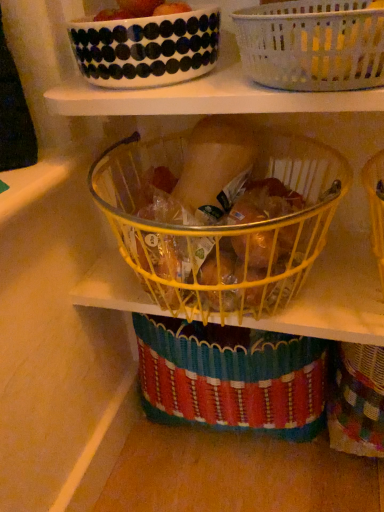
Locate an element on the screen. Image resolution: width=384 pixels, height=512 pixels. white woven basket at upper center, which is the 2th basket in bottom-to-top order is located at coordinates (312, 45).

Find the location of a particular element. The height and width of the screenshot is (512, 384). yellow wire basket at center, which ranks as the second basket in top-to-bottom order is located at coordinates (221, 221).

Locate an element on the screen. white glossy bowl at upper center is located at coordinates pos(147,48).

This screenshot has height=512, width=384. What are the coordinates of `white woven basket at upper center, which is the 2th basket in bottom-to-top order` in the screenshot? It's located at (312, 45).

Based on the photo, what's the angular difference between smooth red tomato at upper center and yellow wire basket at center, the first basket positioned from the bottom,'s facing directions?

They differ by 0.00177 degrees in their facing directions.

Is smooth red tomato at upper center facing towards yellow wire basket at center, the first basket positioned from the bottom?

No, smooth red tomato at upper center is not aimed at yellow wire basket at center, the first basket positioned from the bottom.

Who is bigger, smooth red tomato at upper center or yellow wire basket at center, the first basket positioned from the bottom?

yellow wire basket at center, the first basket positioned from the bottom.

Measure the distance between smooth red tomato at upper center and yellow wire basket at center, which ranks as the second basket in top-to-bottom order.

smooth red tomato at upper center and yellow wire basket at center, which ranks as the second basket in top-to-bottom order, are 11.95 inches apart from each other.

Does yellow wire basket at center, which ranks as the second basket in top-to-bottom order, turn towards white woven basket at upper center, which appears as the 1th basket when viewed from the top?

No.

In the image, is yellow wire basket at center, which ranks as the second basket in top-to-bottom order, on the left side or the right side of white woven basket at upper center, which appears as the 1th basket when viewed from the top?

From the image, it's evident that yellow wire basket at center, which ranks as the second basket in top-to-bottom order, is to the left of white woven basket at upper center, which appears as the 1th basket when viewed from the top.

Does yellow wire basket at center, which ranks as the second basket in top-to-bottom order, have a greater width compared to white woven basket at upper center, which appears as the 1th basket when viewed from the top?

Yes.

Is yellow wire basket at center, the first basket positioned from the bottom, far from white woven basket at upper center, which is the 2th basket in bottom-to-top order?

No, yellow wire basket at center, the first basket positioned from the bottom, is in close proximity to white woven basket at upper center, which is the 2th basket in bottom-to-top order.

Is point (331, 46) less distant than point (78, 21)?

Yes, point (331, 46) is closer to viewer.

Would you consider white woven basket at upper center, which is the 2th basket in bottom-to-top order, to be distant from white glossy bowl at upper center?

Actually, white woven basket at upper center, which is the 2th basket in bottom-to-top order, and white glossy bowl at upper center are a little close together.

Looking at this image, between white woven basket at upper center, which is the 2th basket in bottom-to-top order, and white glossy bowl at upper center, which one is positioned behind?

white glossy bowl at upper center is more distant.

Consider the image. From the image's perspective, which is above, white glossy bowl at upper center or white woven basket at upper center, which appears as the 1th basket when viewed from the top?

white glossy bowl at upper center is shown above in the image.

Does white glossy bowl at upper center have a lesser height compared to white woven basket at upper center, which is the 2th basket in bottom-to-top order?

Yes.

Which is in front, point (174, 76) or point (364, 26)?

The point (364, 26) is closer.

From a real-world perspective, between white glossy bowl at upper center and white woven basket at upper center, which is the 2th basket in bottom-to-top order, who is vertically higher?

From a 3D spatial view, white glossy bowl at upper center is above.

Is white glossy bowl at upper center inside yellow wire basket at center, the first basket positioned from the bottom?

No, white glossy bowl at upper center is not inside yellow wire basket at center, the first basket positioned from the bottom.

Based on their sizes in the image, would you say yellow wire basket at center, the first basket positioned from the bottom, is bigger or smaller than white glossy bowl at upper center?

Considering their sizes, yellow wire basket at center, the first basket positioned from the bottom, takes up more space than white glossy bowl at upper center.

Is yellow wire basket at center, which ranks as the second basket in top-to-bottom order, placed right next to white glossy bowl at upper center?

yellow wire basket at center, which ranks as the second basket in top-to-bottom order, and white glossy bowl at upper center are not in contact.

Does yellow wire basket at center, which ranks as the second basket in top-to-bottom order, have a lesser height compared to white glossy bowl at upper center?

No, yellow wire basket at center, which ranks as the second basket in top-to-bottom order, is not shorter than white glossy bowl at upper center.

You are a GUI agent. You are given a task and a screenshot of the screen. Output one action in this format:
    pyautogui.click(x=<x>, y=<y>)
    Task: Click on the fruit behind the yellow wire basket at center, which ranks as the second basket in top-to-bottom order
    
    Given the screenshot: What is the action you would take?
    pyautogui.click(x=138, y=7)

Is yellow wire basket at center, the first basket positioned from the bottom, looking in the opposite direction of smooth red tomato at upper center?

No, yellow wire basket at center, the first basket positioned from the bottom, is not facing away from smooth red tomato at upper center.

Consider the image. From a real-world perspective, which is physically below, yellow wire basket at center, which ranks as the second basket in top-to-bottom order, or smooth red tomato at upper center?

yellow wire basket at center, which ranks as the second basket in top-to-bottom order.

Can you confirm if yellow wire basket at center, the first basket positioned from the bottom, is thinner than smooth red tomato at upper center?

Incorrect, the width of yellow wire basket at center, the first basket positioned from the bottom, is not less than that of smooth red tomato at upper center.

Do you think smooth red tomato at upper center is within white woven basket at upper center, which appears as the 1th basket when viewed from the top, or outside of it?

smooth red tomato at upper center is outside white woven basket at upper center, which appears as the 1th basket when viewed from the top.

Is smooth red tomato at upper center looking in the opposite direction of white woven basket at upper center, which appears as the 1th basket when viewed from the top?

That's not correct — smooth red tomato at upper center is not looking away from white woven basket at upper center, which appears as the 1th basket when viewed from the top.

Is smooth red tomato at upper center wider or thinner than white woven basket at upper center, which appears as the 1th basket when viewed from the top?

Considering their sizes, smooth red tomato at upper center looks slimmer than white woven basket at upper center, which appears as the 1th basket when viewed from the top.

Is smooth red tomato at upper center in front of white woven basket at upper center, which appears as the 1th basket when viewed from the top?

No, smooth red tomato at upper center is further to the viewer.

Where is `the 1st basket counting from the right of the smooth red tomato at upper center`? This screenshot has width=384, height=512. the 1st basket counting from the right of the smooth red tomato at upper center is located at coordinates (221, 221).

Locate an element on the screen. This screenshot has width=384, height=512. basket that appears above the yellow wire basket at center, which ranks as the second basket in top-to-bottom order (from a real-world perspective) is located at coordinates (312, 45).

Considering their positions, is smooth red tomato at upper center positioned closer to white glossy bowl at upper center than white woven basket at upper center, which appears as the 1th basket when viewed from the top?

The object closer to white glossy bowl at upper center is smooth red tomato at upper center.

Considering their positions, is white woven basket at upper center, which is the 2th basket in bottom-to-top order, positioned further to white glossy bowl at upper center than smooth red tomato at upper center?

The object further to white glossy bowl at upper center is white woven basket at upper center, which is the 2th basket in bottom-to-top order.

Based on their spatial positions, is yellow wire basket at center, which ranks as the second basket in top-to-bottom order, or white woven basket at upper center, which appears as the 1th basket when viewed from the top, closer to smooth red tomato at upper center?

The object closer to smooth red tomato at upper center is white woven basket at upper center, which appears as the 1th basket when viewed from the top.

When comparing their distances from yellow wire basket at center, the first basket positioned from the bottom, does smooth red tomato at upper center or white woven basket at upper center, which appears as the 1th basket when viewed from the top, seem further?

smooth red tomato at upper center is positioned further to the anchor yellow wire basket at center, the first basket positioned from the bottom.

Which object lies further to the anchor point white woven basket at upper center, which is the 2th basket in bottom-to-top order, smooth red tomato at upper center or yellow wire basket at center, which ranks as the second basket in top-to-bottom order?

yellow wire basket at center, which ranks as the second basket in top-to-bottom order.

When comparing their distances from smooth red tomato at upper center, does white glossy bowl at upper center or yellow wire basket at center, the first basket positioned from the bottom, seem further?

yellow wire basket at center, the first basket positioned from the bottom, lies further to smooth red tomato at upper center than the other object.

From the image, which object appears to be farther from yellow wire basket at center, which ranks as the second basket in top-to-bottom order, white glossy bowl at upper center or white woven basket at upper center, which appears as the 1th basket when viewed from the top?

white woven basket at upper center, which appears as the 1th basket when viewed from the top, lies further to yellow wire basket at center, which ranks as the second basket in top-to-bottom order, than the other object.

Based on the photo, based on their spatial positions, is white woven basket at upper center, which appears as the 1th basket when viewed from the top, or yellow wire basket at center, the first basket positioned from the bottom, closer to smooth red tomato at upper center?

Based on the image, white woven basket at upper center, which appears as the 1th basket when viewed from the top, appears to be nearer to smooth red tomato at upper center.

Where is `glass bowl between smooth red tomato at upper center and white woven basket at upper center, which is the 2th basket in bottom-to-top order, from left to right`? This screenshot has width=384, height=512. glass bowl between smooth red tomato at upper center and white woven basket at upper center, which is the 2th basket in bottom-to-top order, from left to right is located at coordinates (147, 48).

Find the location of a particular element. glass bowl that lies between smooth red tomato at upper center and yellow wire basket at center, the first basket positioned from the bottom, from top to bottom is located at coordinates (147, 48).

Identify the location of basket between white glossy bowl at upper center and yellow wire basket at center, which ranks as the second basket in top-to-bottom order, in the up-down direction. 312,45.

At what (x,y) coordinates should I click in order to perform the action: click on basket between smooth red tomato at upper center and yellow wire basket at center, the first basket positioned from the bottom, from top to bottom. Please return your answer as a coordinate pair (x, y). Looking at the image, I should click on click(312, 45).